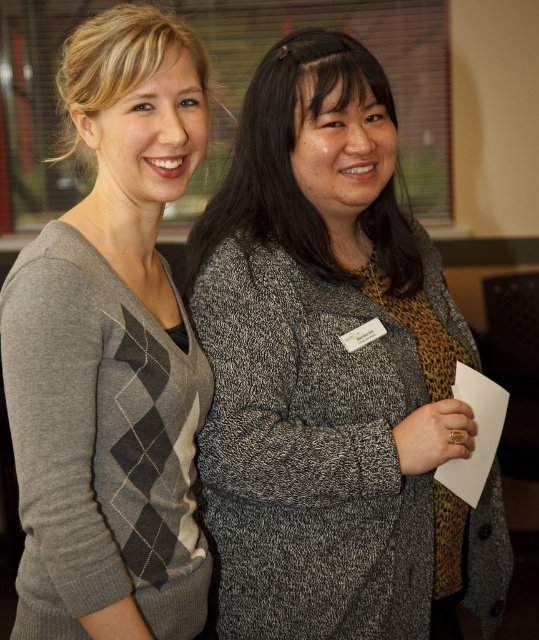
Question: Which object is closer to the camera taking this photo?

Choices:
 (A) gray argyle sweater at left
 (B) speckled gray sweater at center

Answer: (A)

Question: Can you confirm if speckled gray sweater at center is bigger than gray argyle sweater at left?

Choices:
 (A) no
 (B) yes

Answer: (B)

Question: Can you confirm if speckled gray sweater at center is smaller than gray argyle sweater at left?

Choices:
 (A) yes
 (B) no

Answer: (B)

Question: Can you confirm if speckled gray sweater at center is thinner than gray argyle sweater at left?

Choices:
 (A) no
 (B) yes

Answer: (A)

Question: Among these objects, which one is nearest to the camera?

Choices:
 (A) gray argyle sweater at left
 (B) speckled gray sweater at center

Answer: (A)